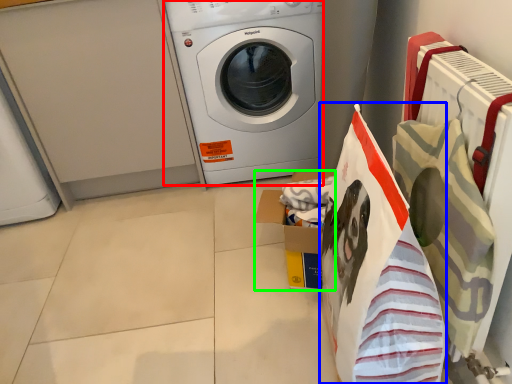
Question: Which object is positioned farthest from washing machine (highlighted by a red box)? Select from shopping bag (highlighted by a blue box) and cardboard box (highlighted by a green box).

Choices:
 (A) shopping bag
 (B) cardboard box

Answer: (A)